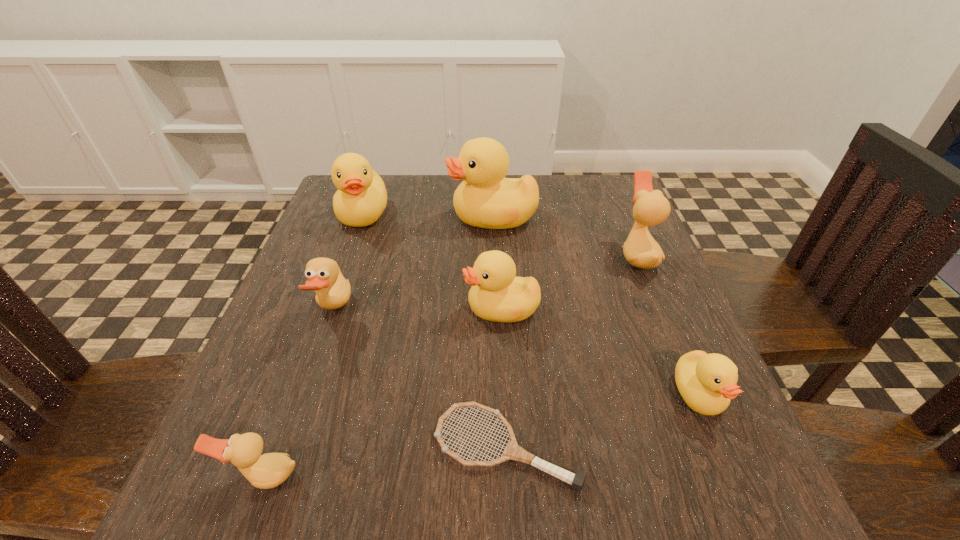
Locate an element on the screen. The height and width of the screenshot is (540, 960). the tallest duck is located at coordinates (485, 199).

Identify the location of the tallest object. The height and width of the screenshot is (540, 960). (485, 199).

The image size is (960, 540). In order to click on the third smallest yellow duck in this screenshot , I will do `click(361, 198)`.

Identify the location of the farthest tan duck. (650, 208).

At what (x,y) coordinates should I click in order to perform the action: click on the rightmost tan duck. Please return your answer as a coordinate pair (x, y). This screenshot has width=960, height=540. Looking at the image, I should click on (650, 208).

Image resolution: width=960 pixels, height=540 pixels. Identify the location of the third farthest yellow duck. (497, 295).

I want to click on the second biggest tan duck, so point(332,290).

Find the location of a particular element. The width and height of the screenshot is (960, 540). the smallest yellow duck is located at coordinates (707, 382).

At what (x,y) coordinates should I click in order to perform the action: click on the sixth farthest duck. Please return your answer as a coordinate pair (x, y). Looking at the image, I should click on (707, 382).

The height and width of the screenshot is (540, 960). I want to click on the nearest duck, so click(x=269, y=470).